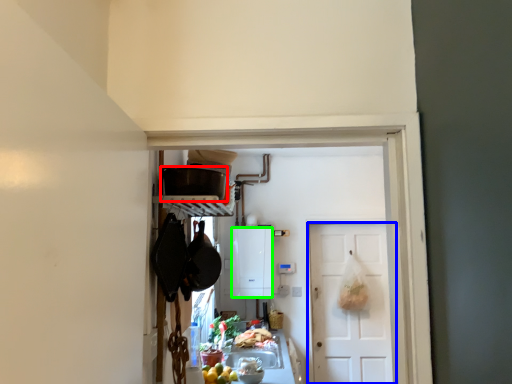
Question: Considering the real-world distances, which object is closest to kitchen appliance (highlighted by a red box)? door (highlighted by a blue box) or cabinetry (highlighted by a green box).

Choices:
 (A) door
 (B) cabinetry

Answer: (B)